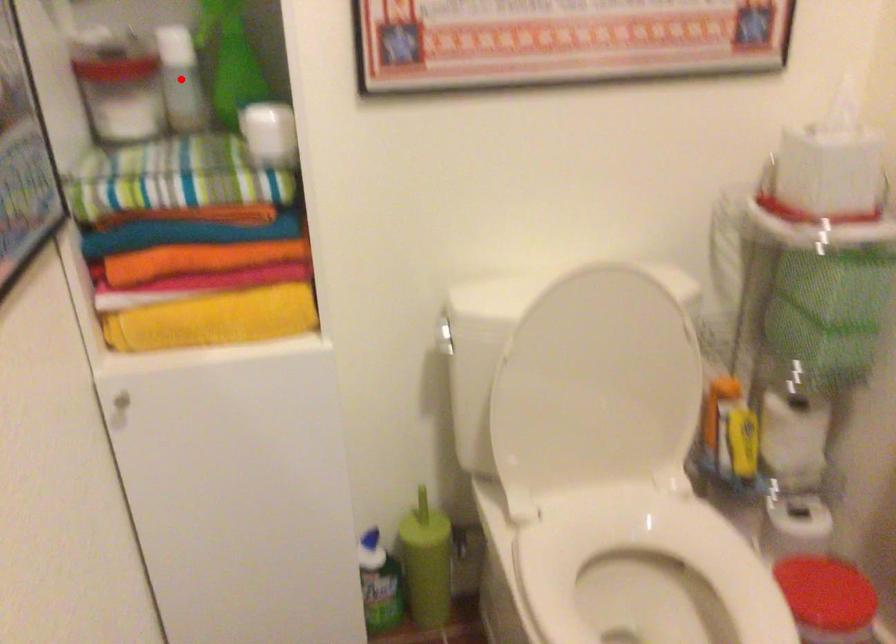
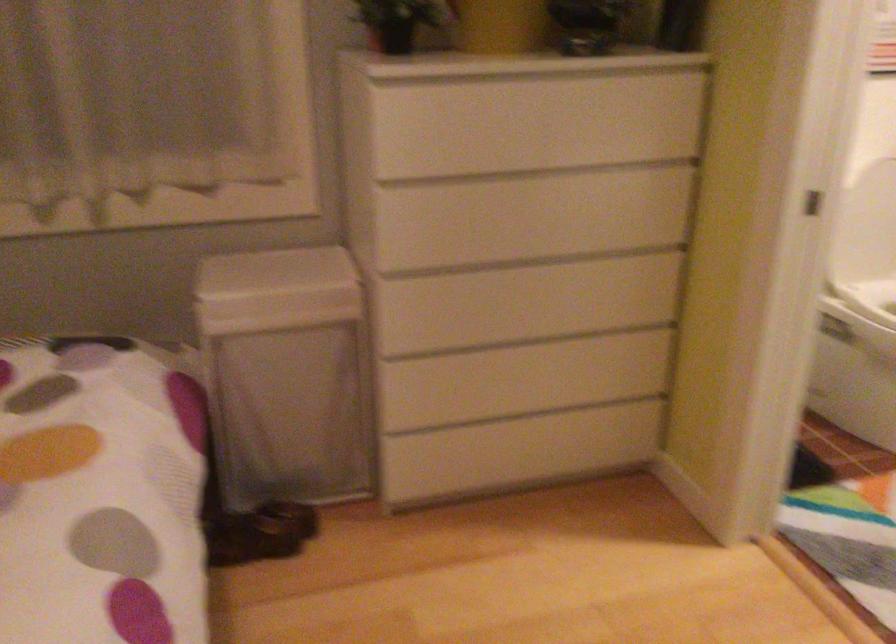
Question: I am providing you with two images of the same scene from different viewpoints. A red point is marked on the first image. Can you still see the location of the red point in image 2?

Choices:
 (A) Yes
 (B) No

Answer: (B)